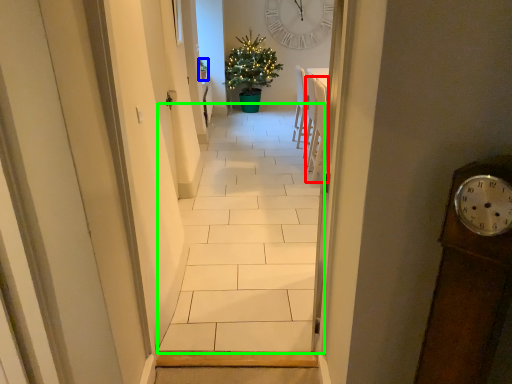
Question: Considering the real-world distances, which object is farthest from chair (highlighted by a red box)? houseplant (highlighted by a blue box) or path (highlighted by a green box)?

Choices:
 (A) houseplant
 (B) path

Answer: (A)